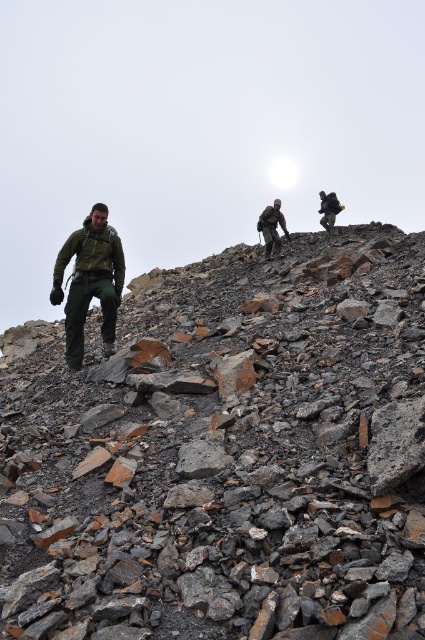
Question: Which of the following is the closest to the observer?

Choices:
 (A) (328, 212)
 (B) (73, 246)

Answer: (B)

Question: Estimate the real-world distances between objects in this image. Which object is farther from the green matte jacket at left?

Choices:
 (A) gray rocky hillside at upper center
 (B) dark green jacket at center
 (C) dark green jacket at upper center

Answer: (C)

Question: From the image, what is the correct spatial relationship of green matte jacket at left in relation to dark green jacket at center?

Choices:
 (A) above
 (B) below

Answer: (B)

Question: Which object appears closest to the camera in this image?

Choices:
 (A) dark green jacket at center
 (B) dark green jacket at upper center
 (C) green matte jacket at left
 (D) gray rocky hillside at upper center

Answer: (D)

Question: Does gray rocky hillside at upper center have a larger size compared to green matte jacket at left?

Choices:
 (A) yes
 (B) no

Answer: (A)

Question: Is green matte jacket at left below dark green jacket at center?

Choices:
 (A) no
 (B) yes

Answer: (B)